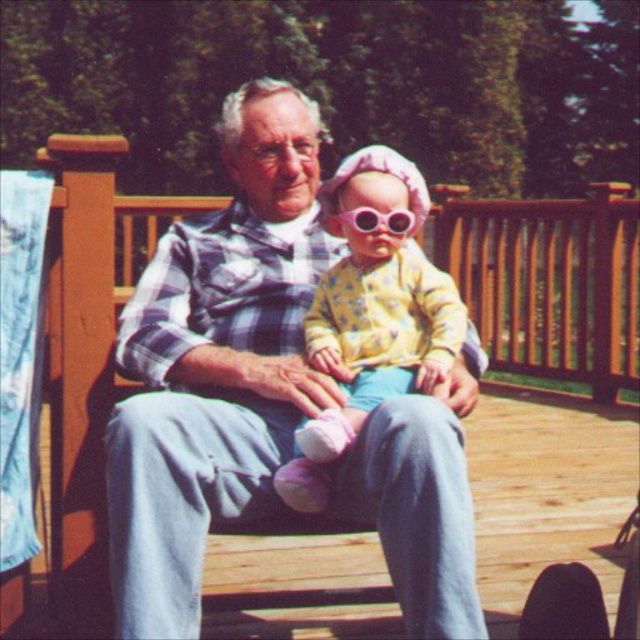
Looking at this image, you are a photographer trying to capture the perfect shot of the scene. You notice a point at coordinates (371, 317). What object is located at this point?

The point at coordinates (371, 317) marks the yellow fabric baby at center.

You are a photographer trying to capture the perfect shot of the yellow fabric baby at center and the pink plastic goggles at center. Since you want both objects to appear the same size in the photo, which object should you move closer to the camera?

The pink plastic goggles at center should be moved closer to the camera because it is smaller than the yellow fabric baby at center. By moving the smaller object closer, it will appear larger in the photo, balancing their sizes with the larger object.

You are a photographer trying to capture the interaction between the matte plaid shirt at center and the yellow fabric baby at center. Since you want to focus on their connection, which object should you ensure is in the foreground to highlight their relationship?

The matte plaid shirt at center is located above the yellow fabric baby at center, so to highlight their connection, ensure the matte plaid shirt at center is in the foreground as it is closer to the viewer.